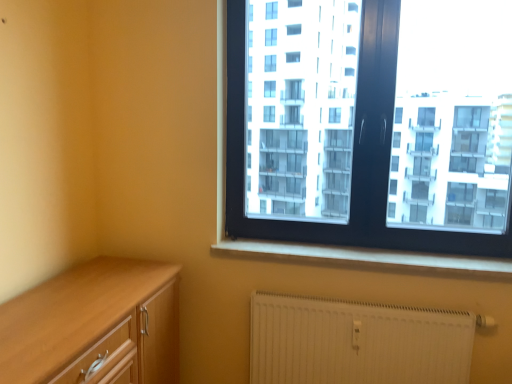
Question: Does white textured radiator at lower right have a greater height compared to white smooth window sill at lower center?

Choices:
 (A) yes
 (B) no

Answer: (A)

Question: From a real-world perspective, is white textured radiator at lower right located beneath white smooth window sill at lower center?

Choices:
 (A) yes
 (B) no

Answer: (A)

Question: Is white textured radiator at lower right bigger than white smooth window sill at lower center?

Choices:
 (A) no
 (B) yes

Answer: (B)

Question: Considering the relative positions of white textured radiator at lower right and white smooth window sill at lower center in the image provided, is white textured radiator at lower right to the left of white smooth window sill at lower center from the viewer's perspective?

Choices:
 (A) yes
 (B) no

Answer: (B)

Question: Can you confirm if white textured radiator at lower right is smaller than white smooth window sill at lower center?

Choices:
 (A) yes
 (B) no

Answer: (B)

Question: Choose the correct answer: Is white textured radiator at lower right inside white smooth window sill at lower center or outside it?

Choices:
 (A) inside
 (B) outside

Answer: (B)

Question: Does point (384, 322) appear closer or farther from the camera than point (484, 266)?

Choices:
 (A) farther
 (B) closer

Answer: (B)

Question: Is white textured radiator at lower right bigger or smaller than white smooth window sill at lower center?

Choices:
 (A) big
 (B) small

Answer: (A)

Question: From a real-world perspective, is white textured radiator at lower right physically located above or below white smooth window sill at lower center?

Choices:
 (A) above
 (B) below

Answer: (B)

Question: Is point (419, 231) positioned closer to the camera than point (438, 352)?

Choices:
 (A) closer
 (B) farther

Answer: (B)

Question: Is black plastic window at upper right wider or thinner than white textured radiator at lower right?

Choices:
 (A) wide
 (B) thin

Answer: (A)

Question: From a real-world perspective, is black plastic window at upper right above or below white textured radiator at lower right?

Choices:
 (A) below
 (B) above

Answer: (B)

Question: Would you say black plastic window at upper right is to the left or to the right of white textured radiator at lower right in the picture?

Choices:
 (A) left
 (B) right

Answer: (B)

Question: Considering the positions of white textured radiator at lower right and light wood cabinet at lower left in the image, is white textured radiator at lower right taller or shorter than light wood cabinet at lower left?

Choices:
 (A) short
 (B) tall

Answer: (A)

Question: From a real-world perspective, is white textured radiator at lower right physically located above or below light wood cabinet at lower left?

Choices:
 (A) below
 (B) above

Answer: (A)